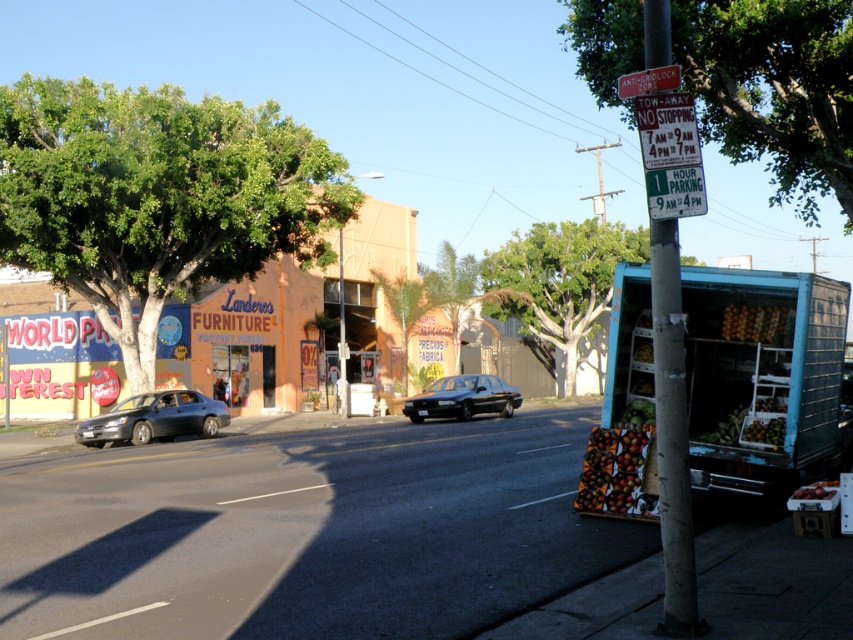
Question: Among these points, which one is farthest from the camera?

Choices:
 (A) (0, 259)
 (B) (407, 376)
 (C) (184, 419)

Answer: (B)

Question: Which point is farther to the camera?

Choices:
 (A) gray concrete pole at right
 (B) shiny black sedan at center

Answer: (B)

Question: Can you confirm if green leafy tree at upper right is positioned above green leafy palm tree at center?

Choices:
 (A) yes
 (B) no

Answer: (A)

Question: Does green leafy tree at upper right have a lesser width compared to matte gray sedan at center-left?

Choices:
 (A) no
 (B) yes

Answer: (A)

Question: Based on their relative distances, which object is nearer to the shiny black sedan at center?

Choices:
 (A) green leafy tree at right
 (B) green leafy palm tree at center

Answer: (B)

Question: Is shiny black sedan at center smaller than green leafy palm tree at center?

Choices:
 (A) no
 (B) yes

Answer: (B)